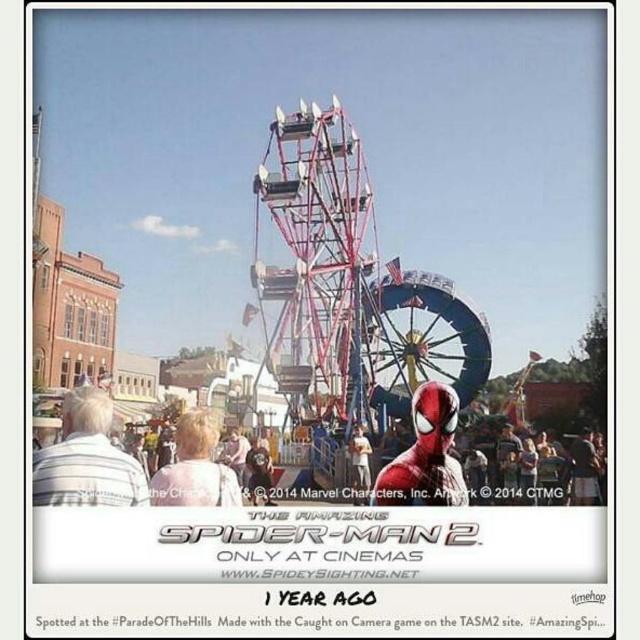
Does metallic red ferris wheel at center have a smaller size compared to matte red costume at center?

Correct, metallic red ferris wheel at center occupies less space than matte red costume at center.

At what (x,y) coordinates should I click in order to perform the action: click on metallic red ferris wheel at center. Please return your answer as a coordinate pair (x, y). Looking at the image, I should click on (316, 260).

Measure the distance between point (280, 362) and camera.

The distance of point (280, 362) from camera is 139.86 meters.

Where is `metallic red ferris wheel at center`? metallic red ferris wheel at center is located at coordinates (316, 260).

Who is lower down, matte red costume at center or white striped shirt at lower left?

matte red costume at center is below.

Who is higher up, matte red costume at center or white striped shirt at lower left?

white striped shirt at lower left is above.

Is point (189, 436) closer to viewer compared to point (108, 440)?

That is True.

I want to click on matte red costume at center, so click(129, 465).

Is metallic red ferris wheel at center thinner than white striped shirt at lower left?

In fact, metallic red ferris wheel at center might be wider than white striped shirt at lower left.

Can you confirm if metallic red ferris wheel at center is shorter than white striped shirt at lower left?

No.

Which is behind, point (252, 284) or point (144, 484)?

The point (252, 284) is more distant.

You are a GUI agent. You are given a task and a screenshot of the screen. Output one action in this format:
    pyautogui.click(x=<x>, y=<y>)
    Task: Click on the metallic red ferris wheel at center
    This screenshot has width=640, height=640.
    Given the screenshot: What is the action you would take?
    pyautogui.click(x=316, y=260)